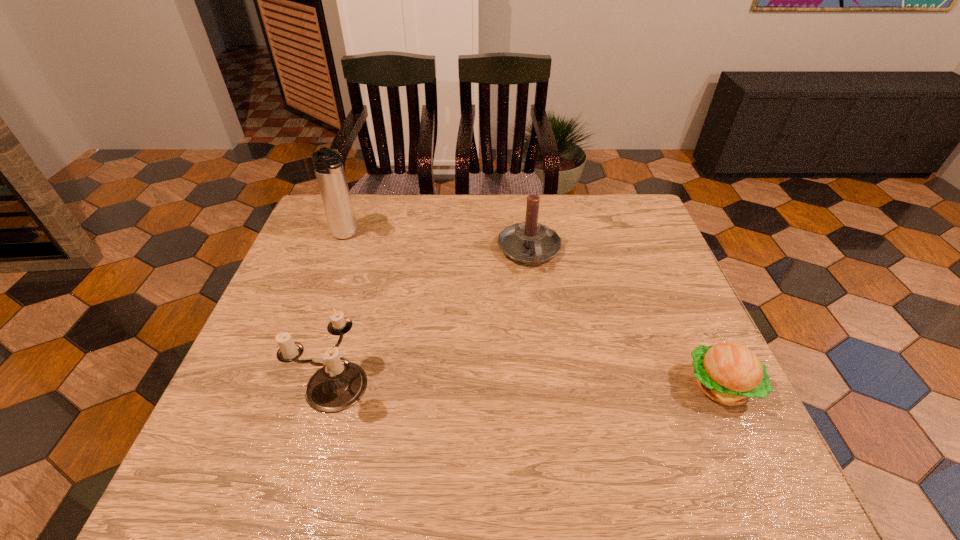
Where is `free space on the desktop that is between the candle holder and the hamburger and is positioned on the handle side of the thermos bottle`? The width and height of the screenshot is (960, 540). free space on the desktop that is between the candle holder and the hamburger and is positioned on the handle side of the thermos bottle is located at coordinates (471, 384).

This screenshot has width=960, height=540. Identify the location of vacant space on the desktop that is between the candle holder and the shortest object and is positioned on the side of the candle with the handle loop. (569, 385).